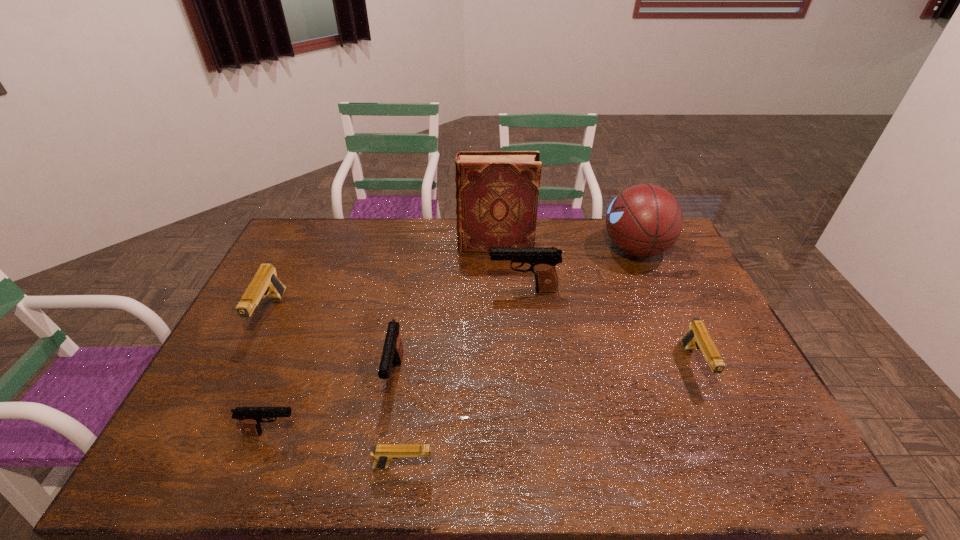
Select which pistol is the fourth closest to the biggest black pistol. Please provide its 2D coordinates. Your answer should be formatted as a tuple, i.e. [(x, y)], where the tuple contains the x and y coordinates of a point satisfying the conditions above.

[(265, 282)]

Locate an element on the screen. This screenshot has height=540, width=960. pistol that is the fourth closest one to the rightmost pistol is located at coordinates (250, 418).

Find the location of a particular element. The width and height of the screenshot is (960, 540). black pistol object that ranks as the second closest to the leftmost pistol is located at coordinates (393, 350).

Point out which black pistol is positioned as the third nearest to the leftmost pistol. Please provide its 2D coordinates. Your answer should be formatted as a tuple, i.e. [(x, y)], where the tuple contains the x and y coordinates of a point satisfying the conditions above.

[(543, 260)]

Identify which tan pistol is located as the second nearest to the shortest pistol. Please provide its 2D coordinates. Your answer should be formatted as a tuple, i.e. [(x, y)], where the tuple contains the x and y coordinates of a point satisfying the conditions above.

[(697, 336)]

Choose which tan pistol is the third nearest neighbor to the second nearest black pistol. Please provide its 2D coordinates. Your answer should be formatted as a tuple, i.e. [(x, y)], where the tuple contains the x and y coordinates of a point satisfying the conditions above.

[(697, 336)]

Find the location of a particular element. blank area in the image that satisfies the following two spatial constraints: 1. at the barrel of the second pistol from right to left; 2. at the barrel of the leftmost tan pistol is located at coordinates (526, 315).